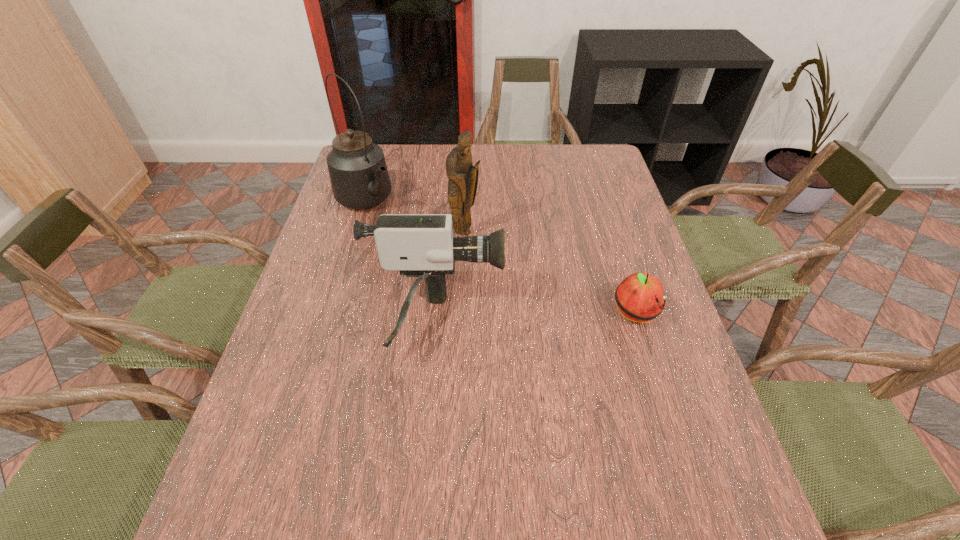
Where is `vacant space at the left edge of the desktop`? vacant space at the left edge of the desktop is located at coordinates (312, 344).

At what (x,y) coordinates should I click in order to perform the action: click on vacant space at the right edge. Please return your answer as a coordinate pair (x, y). This screenshot has width=960, height=540. Looking at the image, I should click on (618, 309).

The height and width of the screenshot is (540, 960). I want to click on free spot at the far left corner of the desktop, so click(x=396, y=153).

This screenshot has height=540, width=960. In the image, there is a desktop. Identify the location of vacant area at the far right corner. (590, 165).

In order to click on blank region between the third tallest object and the apple in this screenshot , I will do `click(536, 318)`.

This screenshot has height=540, width=960. I want to click on vacant space in between the rightmost object and the third tallest object, so click(536, 318).

Find the location of a particular element. vacant point located between the second shortest object and the second farthest object is located at coordinates (450, 277).

The image size is (960, 540). What are the coordinates of `vacant space in between the camcorder and the second farthest object` in the screenshot? It's located at (450, 277).

Find the location of `free space between the rightmost object and the third nearest object`. free space between the rightmost object and the third nearest object is located at coordinates click(550, 273).

Locate an element on the screen. free space between the camcorder and the third nearest object is located at coordinates tap(450, 277).